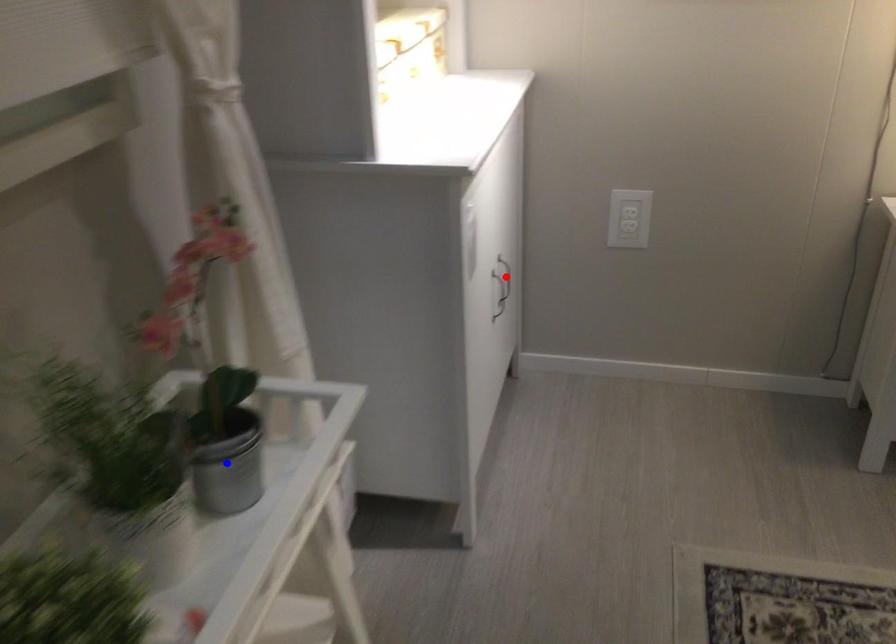
Question: Which of the two points in the image is closer to the camera?

Choices:
 (A) Blue point is closer.
 (B) Red point is closer.

Answer: (A)